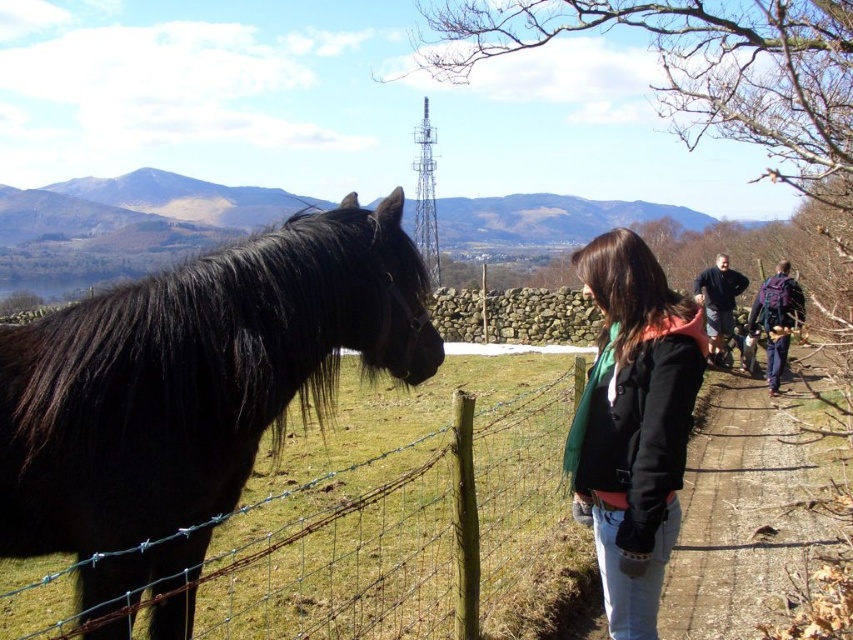
Question: Which point appears closest to the camera in this image?

Choices:
 (A) (785, 310)
 (B) (369, 356)
 (C) (733, 301)

Answer: (B)

Question: Which object is farther from the camera taking this photo?

Choices:
 (A) brown dirt path at lower right
 (B) dark blue backpack at right

Answer: (B)

Question: Does black fleece jacket at center have a smaller size compared to dark blue backpack at right?

Choices:
 (A) no
 (B) yes

Answer: (B)

Question: Is dark blue backpack at right to the left of dark blue fleece jacket at center from the viewer's perspective?

Choices:
 (A) yes
 (B) no

Answer: (B)

Question: Is black shaggy horse at left wider than brown dirt path at lower right?

Choices:
 (A) no
 (B) yes

Answer: (B)

Question: Which point is closer to the camera?

Choices:
 (A) dark blue backpack at right
 (B) black fleece jacket at center
 (C) dark blue fleece jacket at center
 (D) brown dirt path at lower right

Answer: (B)